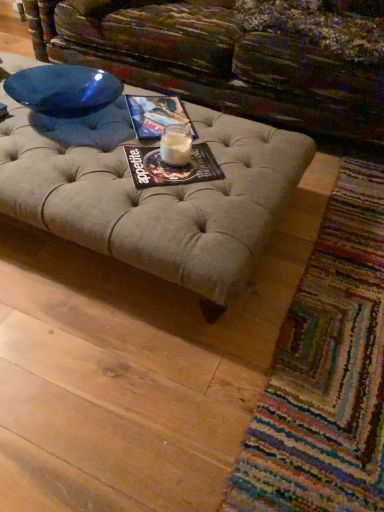
The height and width of the screenshot is (512, 384). I want to click on free space to the right of white glass candle at center, so click(212, 159).